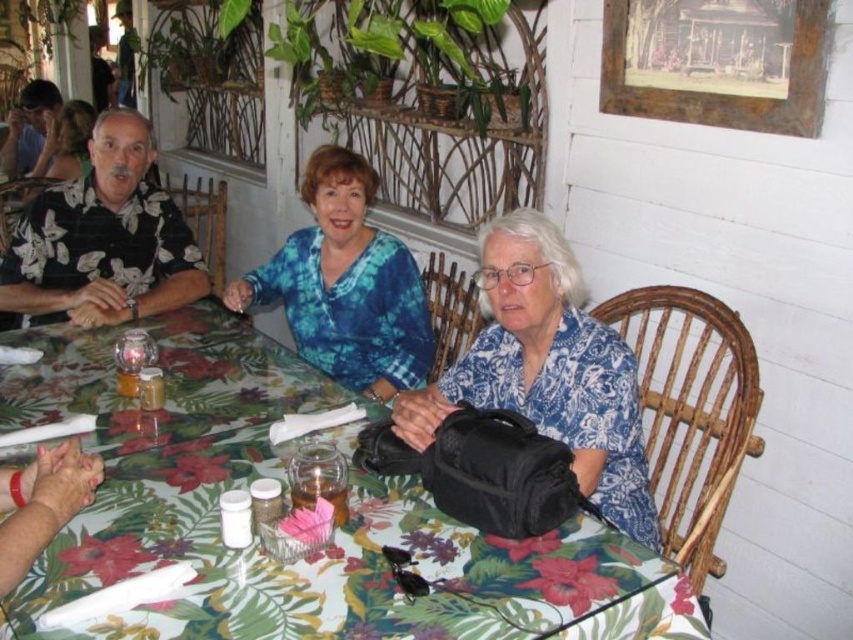
Is floral-patterned tablecloth at center positioned in front of black fabric bag at center?

Yes, floral-patterned tablecloth at center is closer to the viewer.

Can you confirm if floral-patterned tablecloth at center is positioned to the left of black fabric bag at center?

Indeed, floral-patterned tablecloth at center is positioned on the left side of black fabric bag at center.

Is point (451, 621) positioned before point (503, 324)?

Yes, point (451, 621) is in front of point (503, 324).

This screenshot has width=853, height=640. Identify the location of floral-patterned tablecloth at center. (285, 486).

Between point (651, 518) and point (381, 339), which one is positioned in front?

Point (651, 518) is more forward.

Is black fabric bag at center shorter than blue tie-dye blouse at center?

Yes.

Which is in front, point (485, 312) or point (329, 269)?

Positioned in front is point (485, 312).

At what (x,y) coordinates should I click in order to perform the action: click on black fabric bag at center. Please return your answer as a coordinate pair (x, y). Image resolution: width=853 pixels, height=640 pixels. Looking at the image, I should click on (547, 371).

Does floral-patterned tablecloth at center have a larger size compared to blue tie-dye blouse at center?

Correct, floral-patterned tablecloth at center is larger in size than blue tie-dye blouse at center.

Which of these two, floral-patterned tablecloth at center or blue tie-dye blouse at center, stands shorter?

Standing shorter between the two is floral-patterned tablecloth at center.

Locate an element on the screen. Image resolution: width=853 pixels, height=640 pixels. floral-patterned tablecloth at center is located at coordinates (285, 486).